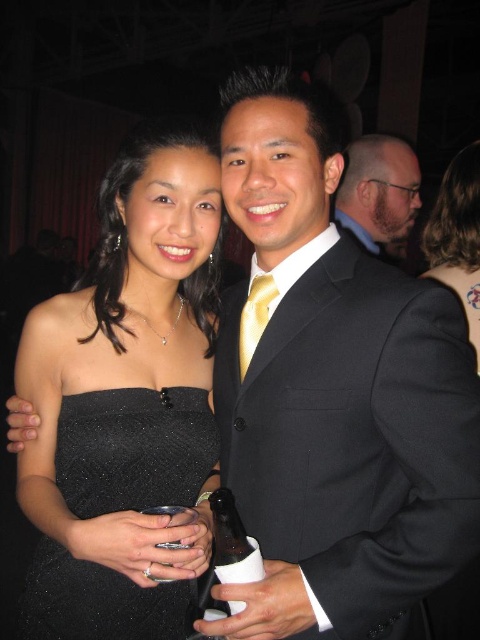
You are a photographer at the event and need to position two guests for a group photo. The guests are wearing the black sparkly dress at center and the black satin dress at upper right. Based on their clothing sizes, which guest should you place closer to the camera to ensure both appear proportionate in the photo?

The black sparkly dress at center is smaller than the black satin dress at upper right. To make both appear proportionate, the guest in the black sparkly dress at center should be placed closer to the camera so that their smaller size is visually balanced with the larger dress of the other guest.

You are a photographer at the event and want to capture a photo of both the dark gray suit at center and the gold silk tie at center. Which object should you focus on first if you want to include both in the frame without moving the camera?

The dark gray suit at center is to the right of the gold silk tie at center, so you should focus on the gold silk tie at center first to ensure both are in the frame without moving the camera.

You are standing at the center of the room and see two points marked in the image. The first point is at coordinates point (x=247, y=480) and the second point is at point (x=365, y=182). Which point is closer to you?

Point (x=247, y=480) is in front of point (x=365, y=182), so the first point is closer to you.